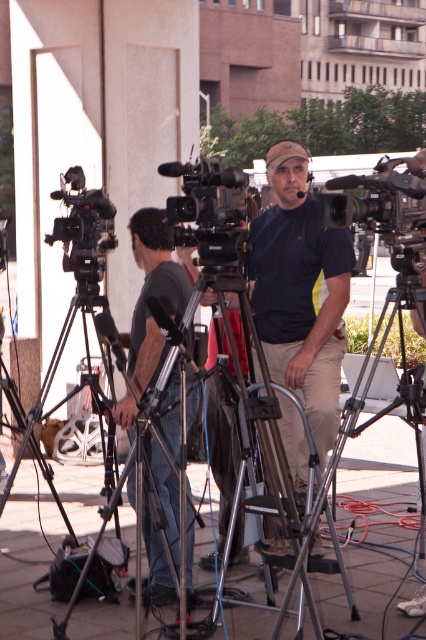
Question: Which point appears farthest from the camera in this image?

Choices:
 (A) (402, 216)
 (B) (201, 211)
 (C) (276, 433)
 (D) (261, 323)

Answer: (D)

Question: Estimate the real-world distances between objects in this image. Which object is farther from the black matte camera at left?

Choices:
 (A) black plastic camera at center
 (B) black matte camera at center
 (C) dark gray fabric shirt at center

Answer: (B)

Question: Can you confirm if dark gray fabric shirt at center is positioned to the right of silver metallic tripod at center?

Choices:
 (A) no
 (B) yes

Answer: (A)

Question: Where is matte blue shirt at center located in relation to silver metallic tripod at center in the image?

Choices:
 (A) above
 (B) below

Answer: (A)

Question: Which object appears farthest from the camera in this image?

Choices:
 (A) black matte camera at left
 (B) matte blue shirt at center
 (C) silver metallic tripod at center

Answer: (A)

Question: In this image, where is matte blue shirt at center located relative to silver metallic tripod at center?

Choices:
 (A) left
 (B) right

Answer: (B)